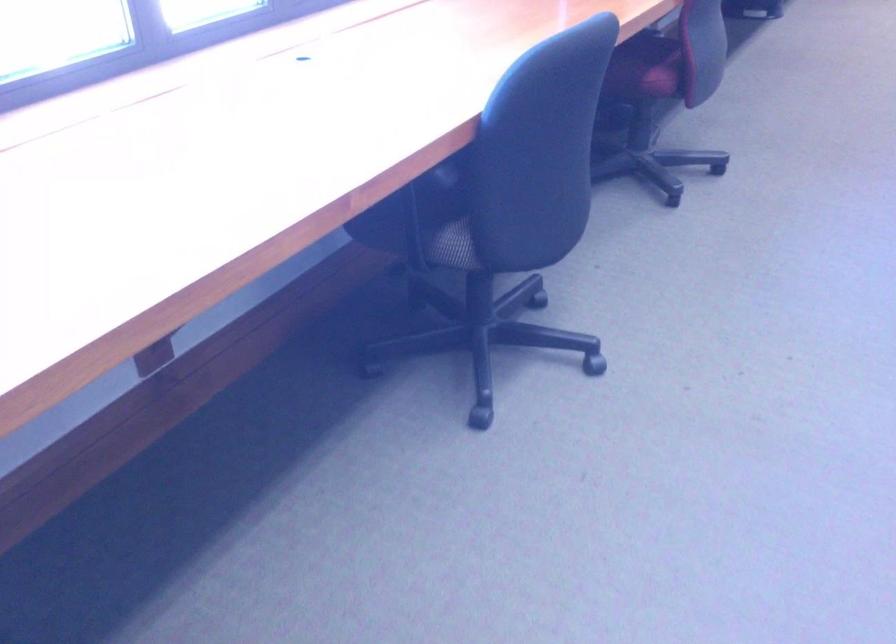
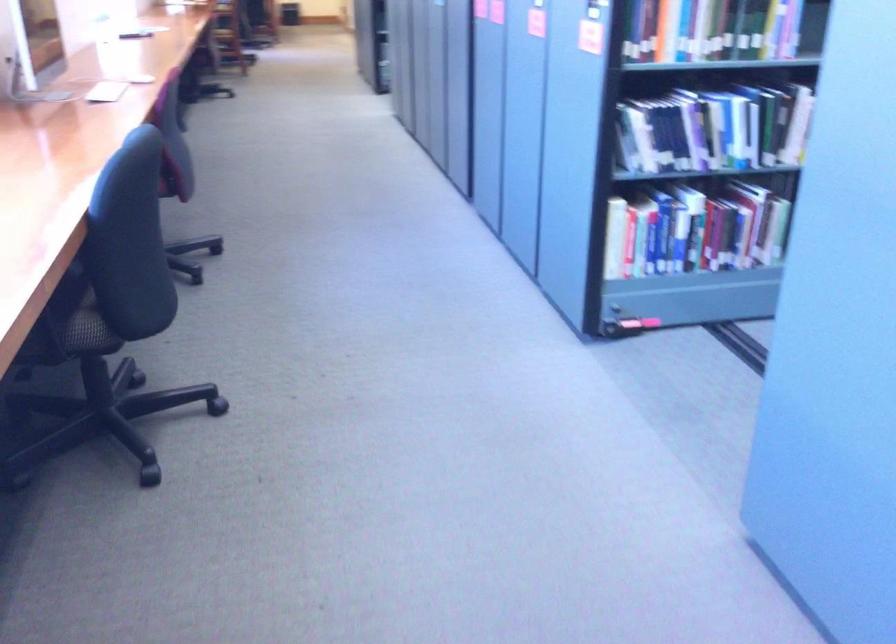
In the second image, find the point that corresponds to [433,238] in the first image.

(73, 324)